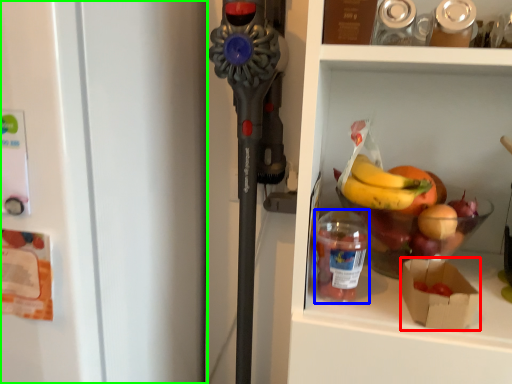
Question: Which object is positioned farthest from box (highlighted by a red box)? Select from bottle (highlighted by a blue box) and refrigerator (highlighted by a green box).

Choices:
 (A) bottle
 (B) refrigerator

Answer: (B)